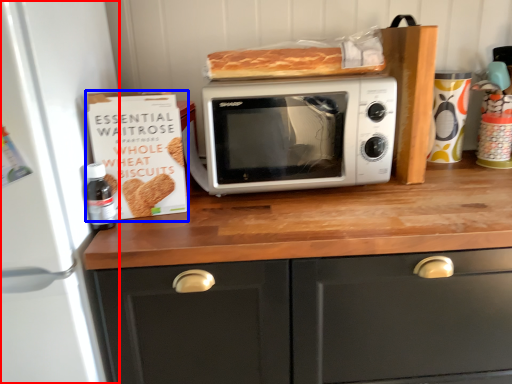
Question: Which object appears farthest to the camera in this image, appliance (highlighted by a red box) or cardboard box (highlighted by a blue box)?

Choices:
 (A) appliance
 (B) cardboard box

Answer: (B)